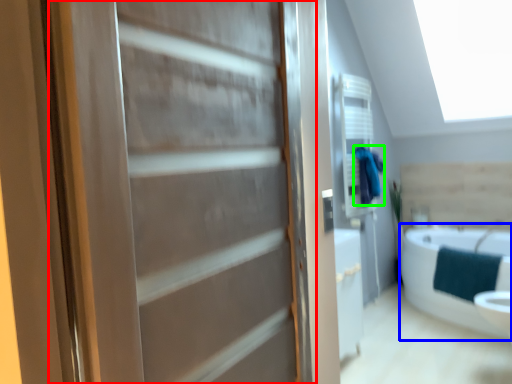
Question: Estimate the real-world distances between objects in this image. Which object is farther from door (highlighted by a red box), bathtub (highlighted by a blue box) or bathrobe (highlighted by a green box)?

Choices:
 (A) bathtub
 (B) bathrobe

Answer: (B)